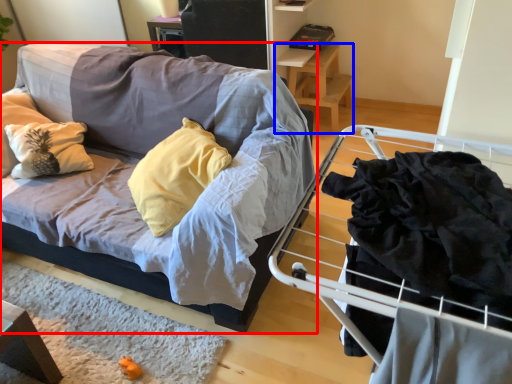
Question: Among these objects, which one is farthest to the camera, studio couch (highlighted by a red box) or table (highlighted by a blue box)?

Choices:
 (A) studio couch
 (B) table

Answer: (B)